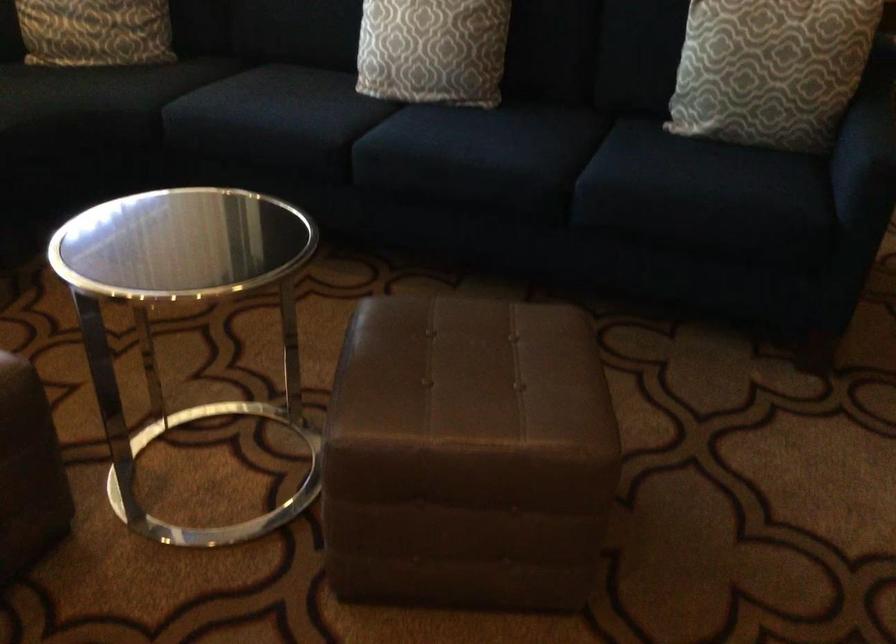
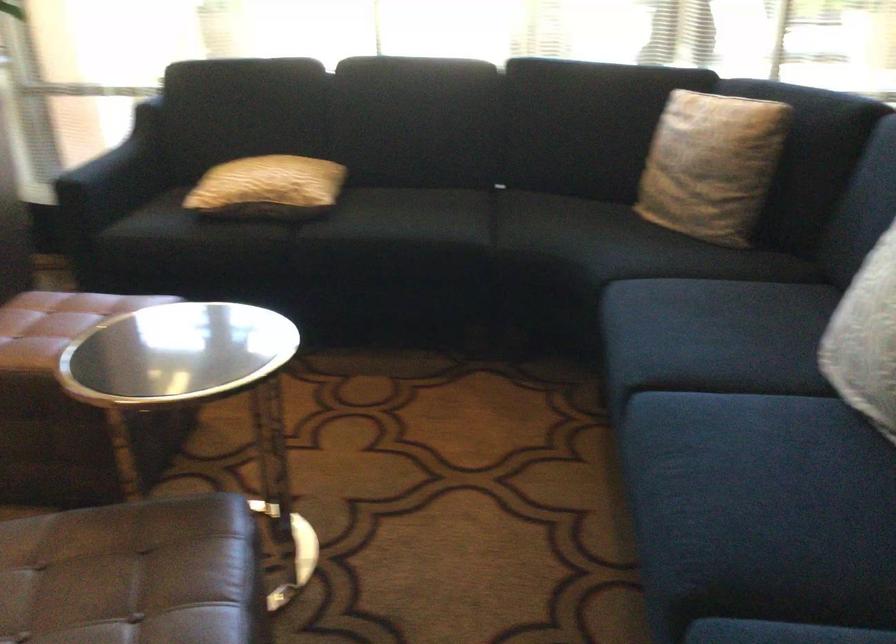
Where in the second image is the point corresponding to point 464,136 from the first image?

(745, 459)